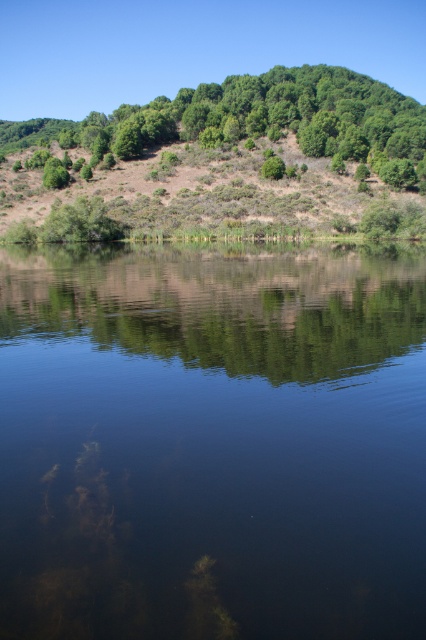
You are standing at the edge of the transparent water at center and want to walk to the green leafy hillside at upper center. Based on the scene description, which direction should you move to reach the hillside?

The transparent water at center has a lesser width compared to the green leafy hillside at upper center, so you should move towards the upper direction to reach the hillside.

You are standing at the edge of the transparent water at center and want to walk towards the green leafy hillside at upper center. Which direction should you head to reach it?

You should head to the left since the transparent water at center is on the right side of the green leafy hillside at upper center, so moving left will take you towards the hillside.

You are standing at the origin point in the image. Which direction should you move to reach the transparent water at center?

The transparent water at center is located at point 0.691 on the x axis and 0.498 on the y axis. Since you are at the origin point, you should move towards the positive x and positive y direction to reach the transparent water at center.